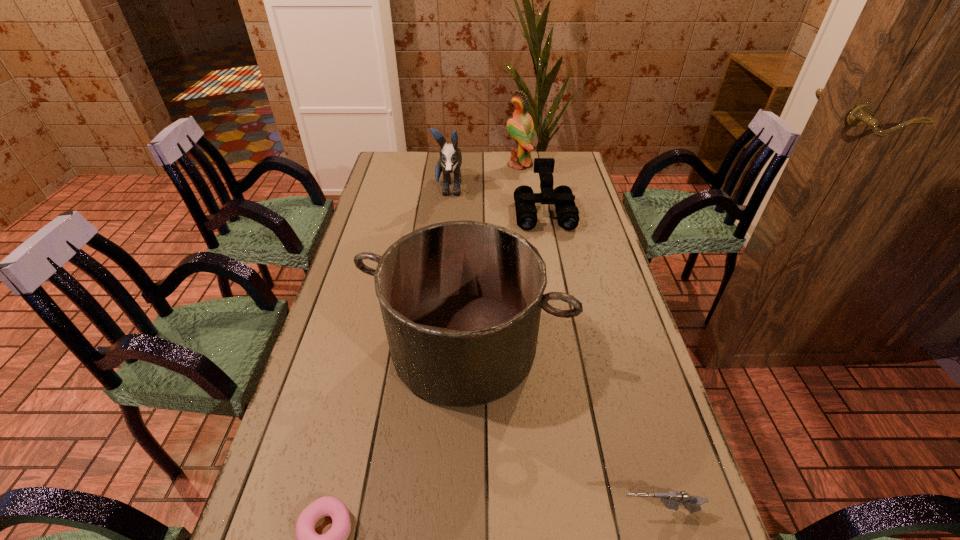
Identify the location of parrot. The height and width of the screenshot is (540, 960). (521, 128).

Find the location of a particular element. puppy is located at coordinates (450, 161).

I want to click on the fourth farthest object, so click(x=461, y=301).

In order to click on binoculars in this screenshot , I will do `click(562, 197)`.

Identify the location of gun. (671, 500).

You are a GUI agent. You are given a task and a screenshot of the screen. Output one action in this format:
    pyautogui.click(x=<x>, y=<y>)
    Task: Click on the free spot located on the front-facing side of the parrot
    The height and width of the screenshot is (540, 960).
    Given the screenshot: What is the action you would take?
    [461, 165]

The image size is (960, 540). In order to click on vacant space situated on the front-facing side of the parrot in this screenshot , I will do (477, 165).

This screenshot has width=960, height=540. In order to click on vacant area situated on the front-facing side of the parrot in this screenshot , I will do `click(492, 165)`.

At what (x,y) coordinates should I click in order to perform the action: click on free space located 0.400m on the front-facing side of the puppy. Please return your answer as a coordinate pair (x, y). The height and width of the screenshot is (540, 960). Looking at the image, I should click on (440, 280).

Identify the location of vacant space situated on the right of the third nearest object. (599, 347).